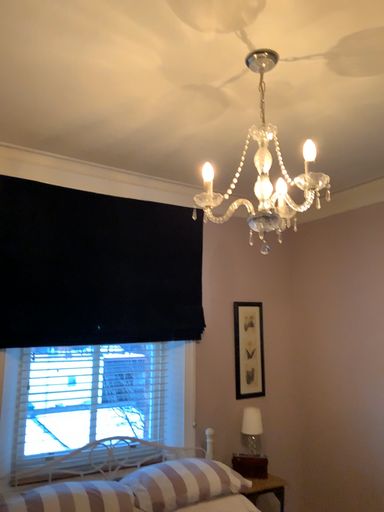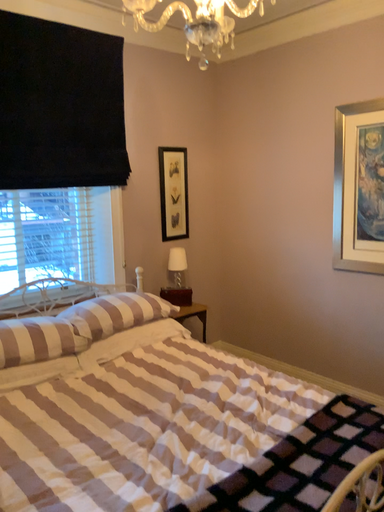
Question: Which way did the camera rotate in the video?

Choices:
 (A) rotated downward
 (B) rotated upward

Answer: (A)